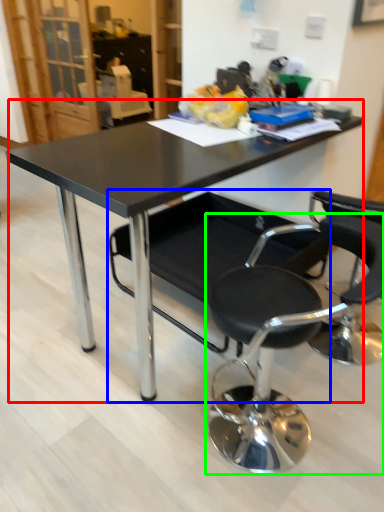
Question: Which object is positioned farthest from table (highlighted by a red box)? Select from chair (highlighted by a blue box) and chair (highlighted by a green box).

Choices:
 (A) chair
 (B) chair

Answer: (B)